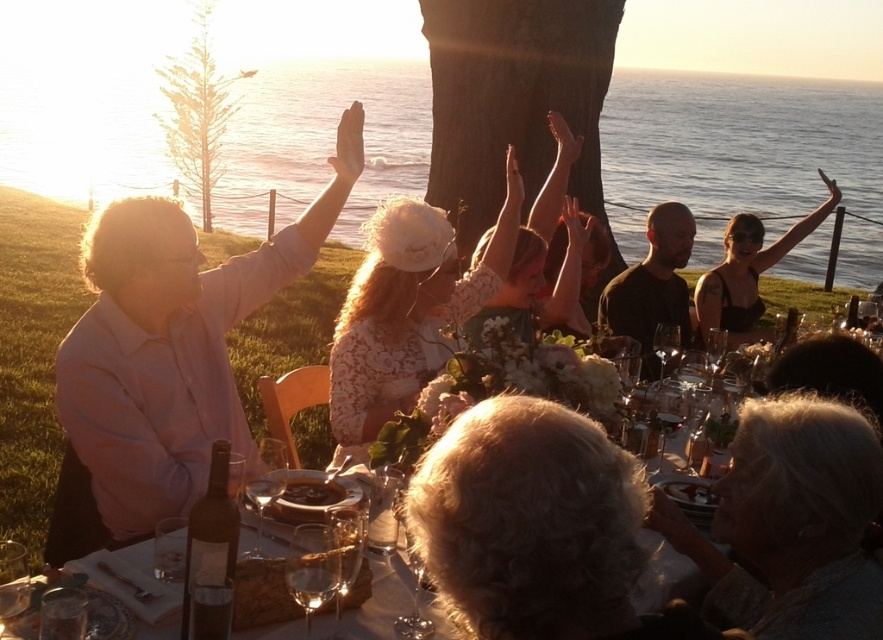
Question: Is green leafy tree at upper left wider than dark brown wooden plate at center?

Choices:
 (A) yes
 (B) no

Answer: (A)

Question: Which point is farther to the camera?

Choices:
 (A) dark brown shirt at center
 (B) white lace dress at center
 (C) clear blue water at upper center
 (D) brown rough bark at center

Answer: (D)

Question: Is brown rough bark at center above green leafy tree at upper left?

Choices:
 (A) yes
 (B) no

Answer: (B)

Question: Which of these objects is positioned farthest from the gray hair at lower right?

Choices:
 (A) white lace dress at center
 (B) clear blue water at upper center
 (C) green leafy tree at upper left

Answer: (C)

Question: Which object appears closest to the camera in this image?

Choices:
 (A) green leafy tree at upper left
 (B) gray curly hair at lower center
 (C) gray hair at lower right
 (D) matte pink shirt at left

Answer: (B)

Question: Can you confirm if gray hair at lower right is bigger than dark brown shirt at center?

Choices:
 (A) no
 (B) yes

Answer: (A)